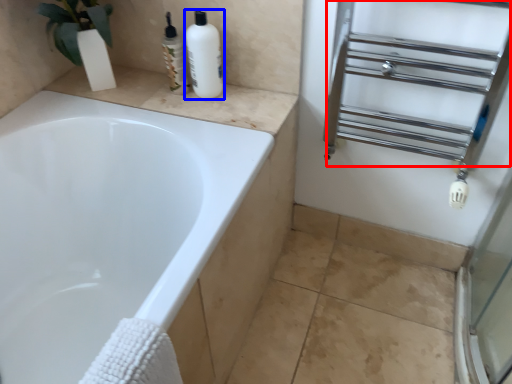
Question: Among these objects, which one is nearest to the camera, shelf (highlighted by a red box) or cleaning product (highlighted by a blue box)?

Choices:
 (A) shelf
 (B) cleaning product

Answer: (A)